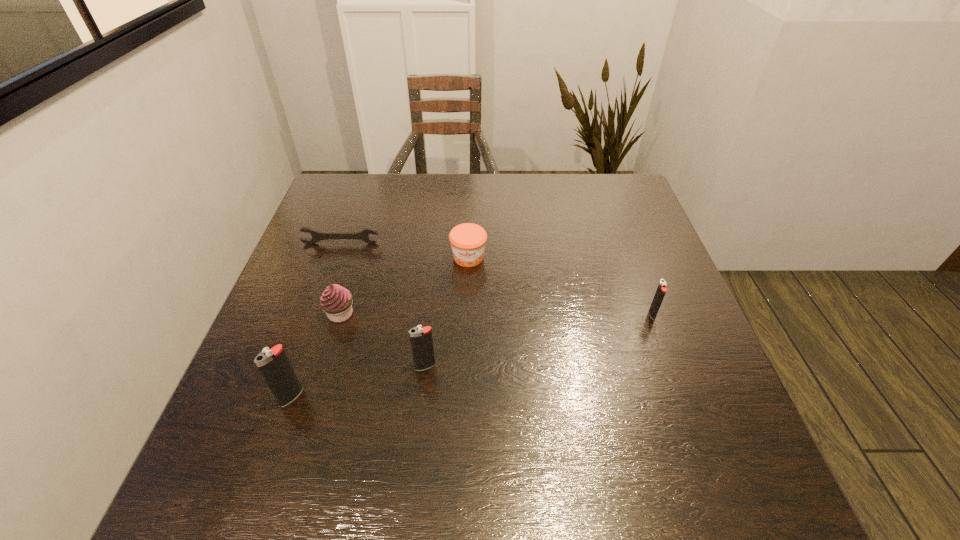
Choose which igniter is the second nearest neighbor to the nearest object. Please provide its 2D coordinates. Your answer should be formatted as a tuple, i.e. [(x, y)], where the tuple contains the x and y coordinates of a point satisfying the conditions above.

[(661, 290)]

Find the location of a particular element. The width and height of the screenshot is (960, 540). igniter identified as the second closest to the fifth shortest object is located at coordinates (661, 290).

What are the coordinates of `vacant space that satisfies the following two spatial constraints: 1. on the open ends of the tallest object; 2. on the right side of the wrench` in the screenshot? It's located at (286, 397).

The width and height of the screenshot is (960, 540). Identify the location of vacant area in the image that satisfies the following two spatial constraints: 1. on the open ends of the fourth object from left to right; 2. on the left side of the farthest object. (298, 366).

Locate an element on the screen. The height and width of the screenshot is (540, 960). vacant area in the image that satisfies the following two spatial constraints: 1. on the back side of the tallest igniter; 2. on the right side of the farthest igniter is located at coordinates (320, 314).

This screenshot has height=540, width=960. Find the location of `free location that satisfies the following two spatial constraints: 1. on the open ends of the wrench; 2. on the left side of the nearest object`. free location that satisfies the following two spatial constraints: 1. on the open ends of the wrench; 2. on the left side of the nearest object is located at coordinates (286, 397).